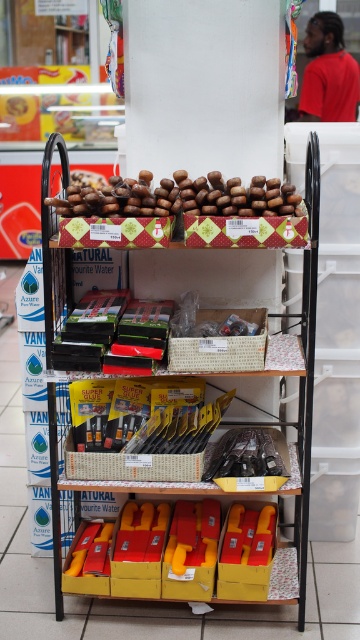
Which of these two, wooden handles at upper center or wooden beads at center, stands shorter?

With less height is wooden beads at center.

Can you confirm if wooden handles at upper center is taller than wooden beads at center?

Indeed, wooden handles at upper center has a greater height compared to wooden beads at center.

I want to click on wooden handles at upper center, so click(x=123, y=490).